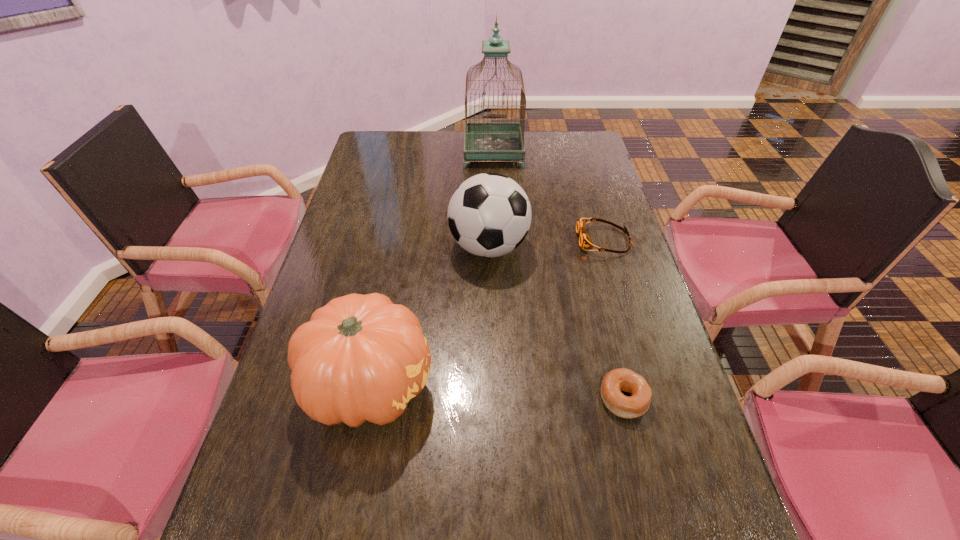
This screenshot has width=960, height=540. What are the coordinates of `the tallest object` in the screenshot? It's located at (483, 140).

Find the location of `the farthest object`. the farthest object is located at coordinates pos(483,140).

The height and width of the screenshot is (540, 960). I want to click on soccer ball, so click(489, 215).

Locate an element on the screen. the leftmost object is located at coordinates (360, 357).

You are a GUI agent. You are given a task and a screenshot of the screen. Output one action in this format:
    pyautogui.click(x=<x>, y=<y>)
    Task: Click on the bagel
    
    Given the screenshot: What is the action you would take?
    pyautogui.click(x=622, y=379)

The width and height of the screenshot is (960, 540). Find the location of `goggles`. goggles is located at coordinates (585, 241).

The image size is (960, 540). What are the coordinates of `vacant region located 0.060m at the door of the farthest object` in the screenshot? It's located at (494, 177).

The height and width of the screenshot is (540, 960). What are the coordinates of `free space located 0.180m on the back of the soccer ball` in the screenshot? It's located at (488, 189).

The width and height of the screenshot is (960, 540). In order to click on free space located 0.060m on the carved face of the pumpkin in this screenshot , I will do (462, 385).

At what (x,y) coordinates should I click in order to perform the action: click on free space located 0.140m on the back of the bagel. Please return your answer as a coordinate pair (x, y). The width and height of the screenshot is (960, 540). Looking at the image, I should click on (606, 327).